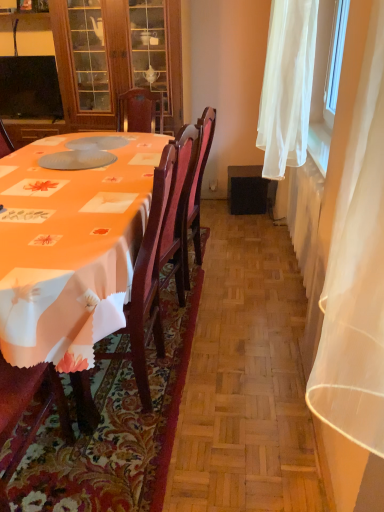
Question: Is black glossy television at upper left with white sheer curtain at right?

Choices:
 (A) yes
 (B) no

Answer: (B)

Question: Could you tell me if black glossy television at upper left is turned towards white sheer curtain at right?

Choices:
 (A) yes
 (B) no

Answer: (B)

Question: Can you confirm if black glossy television at upper left is smaller than white sheer curtain at right?

Choices:
 (A) yes
 (B) no

Answer: (A)

Question: From a real-world perspective, is black glossy television at upper left over white sheer curtain at right?

Choices:
 (A) yes
 (B) no

Answer: (B)

Question: Is the depth of black glossy television at upper left greater than that of white sheer curtain at right?

Choices:
 (A) yes
 (B) no

Answer: (A)

Question: Considering the positions of point (109, 422) and point (157, 25), is point (109, 422) closer or farther from the camera than point (157, 25)?

Choices:
 (A) closer
 (B) farther

Answer: (A)

Question: In terms of width, does orange fabric tablecloth at center look wider or thinner when compared to matte wood cabinet at upper left?

Choices:
 (A) wide
 (B) thin

Answer: (A)

Question: Considering the relative positions of orange fabric tablecloth at center and matte wood cabinet at upper left in the image provided, is orange fabric tablecloth at center to the left or to the right of matte wood cabinet at upper left?

Choices:
 (A) left
 (B) right

Answer: (B)

Question: From the image's perspective, is orange fabric tablecloth at center positioned above or below matte wood cabinet at upper left?

Choices:
 (A) above
 (B) below

Answer: (B)

Question: From the image's perspective, is orange fabric tablecloth at center above or below white sheer curtain at right?

Choices:
 (A) below
 (B) above

Answer: (A)

Question: Is orange fabric tablecloth at center bigger or smaller than white sheer curtain at right?

Choices:
 (A) big
 (B) small

Answer: (B)

Question: In terms of height, does orange fabric tablecloth at center look taller or shorter compared to white sheer curtain at right?

Choices:
 (A) short
 (B) tall

Answer: (A)

Question: Would you say orange fabric tablecloth at center is inside or outside white sheer curtain at right?

Choices:
 (A) outside
 (B) inside

Answer: (A)

Question: From a real-world perspective, is matte wood cabinet at upper left physically located above or below wooden chair at left?

Choices:
 (A) above
 (B) below

Answer: (A)

Question: Is matte wood cabinet at upper left in front of or behind wooden chair at left in the image?

Choices:
 (A) behind
 (B) front

Answer: (A)